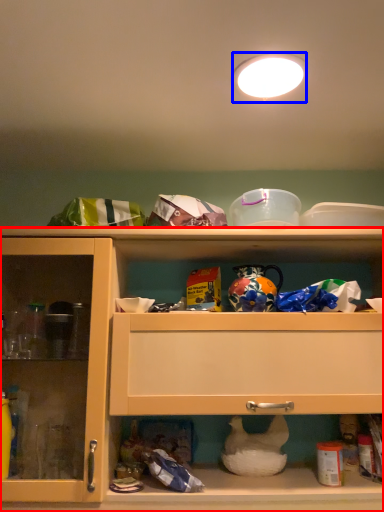
Question: Which object is further to the camera taking this photo, cabinetry (highlighted by a red box) or lighting (highlighted by a blue box)?

Choices:
 (A) cabinetry
 (B) lighting

Answer: (A)